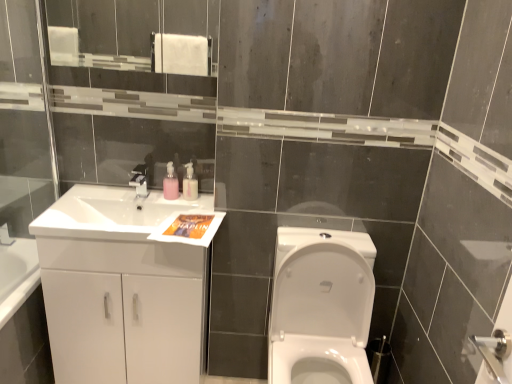
Question: Does matte silver faucet at upper center come behind white glossy cabinet at left?

Choices:
 (A) no
 (B) yes

Answer: (B)

Question: Considering the relative sizes of matte silver faucet at upper center and white glossy cabinet at left in the image provided, is matte silver faucet at upper center wider than white glossy cabinet at left?

Choices:
 (A) no
 (B) yes

Answer: (A)

Question: Is matte silver faucet at upper center directly adjacent to white glossy cabinet at left?

Choices:
 (A) no
 (B) yes

Answer: (A)

Question: Does matte silver faucet at upper center appear on the right side of white glossy cabinet at left?

Choices:
 (A) no
 (B) yes

Answer: (B)

Question: Can you confirm if matte silver faucet at upper center is taller than white glossy cabinet at left?

Choices:
 (A) no
 (B) yes

Answer: (A)

Question: Is matte silver faucet at upper center smaller than white glossy cabinet at left?

Choices:
 (A) yes
 (B) no

Answer: (A)

Question: From a real-world perspective, is white glossy sink at left positioned under pink plastic soap dispenser at upper center, marked as the first soap dispenser in a right-to-left arrangement, based on gravity?

Choices:
 (A) yes
 (B) no

Answer: (A)

Question: From a real-world perspective, is white glossy sink at left physically above pink plastic soap dispenser at upper center, marked as the 2th soap dispenser in a left-to-right arrangement?

Choices:
 (A) yes
 (B) no

Answer: (B)

Question: Is white glossy sink at left thinner than pink plastic soap dispenser at upper center, marked as the first soap dispenser in a right-to-left arrangement?

Choices:
 (A) no
 (B) yes

Answer: (A)

Question: Does white glossy sink at left have a smaller size compared to pink plastic soap dispenser at upper center, marked as the 2th soap dispenser in a left-to-right arrangement?

Choices:
 (A) yes
 (B) no

Answer: (B)

Question: Is the position of white glossy sink at left more distant than that of pink plastic soap dispenser at upper center, marked as the first soap dispenser in a right-to-left arrangement?

Choices:
 (A) yes
 (B) no

Answer: (B)

Question: From the image's perspective, is white glossy sink at left on top of pink plastic soap dispenser at upper center, marked as the 2th soap dispenser in a left-to-right arrangement?

Choices:
 (A) no
 (B) yes

Answer: (A)

Question: From the image's perspective, is white glossy cabinet at left over matte silver faucet at upper center?

Choices:
 (A) yes
 (B) no

Answer: (B)